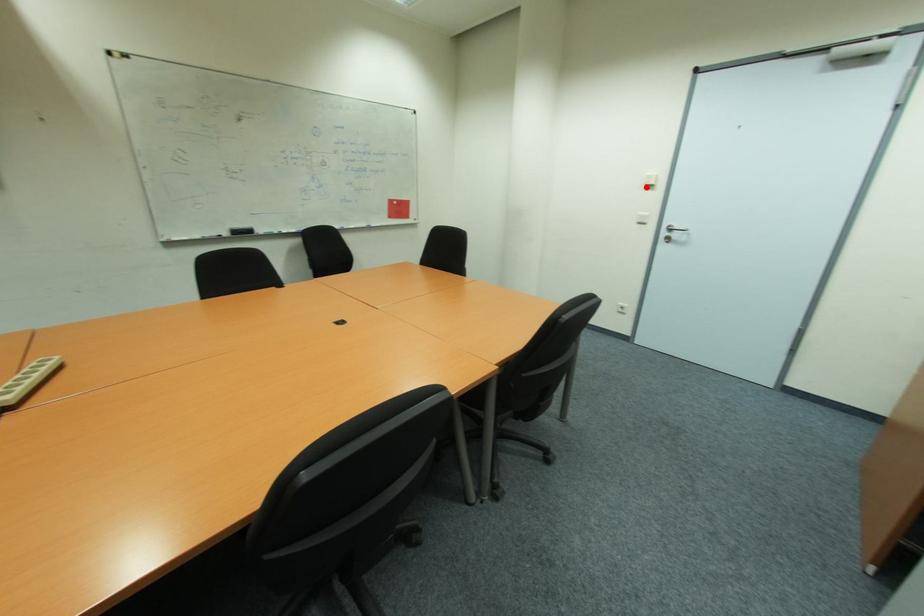
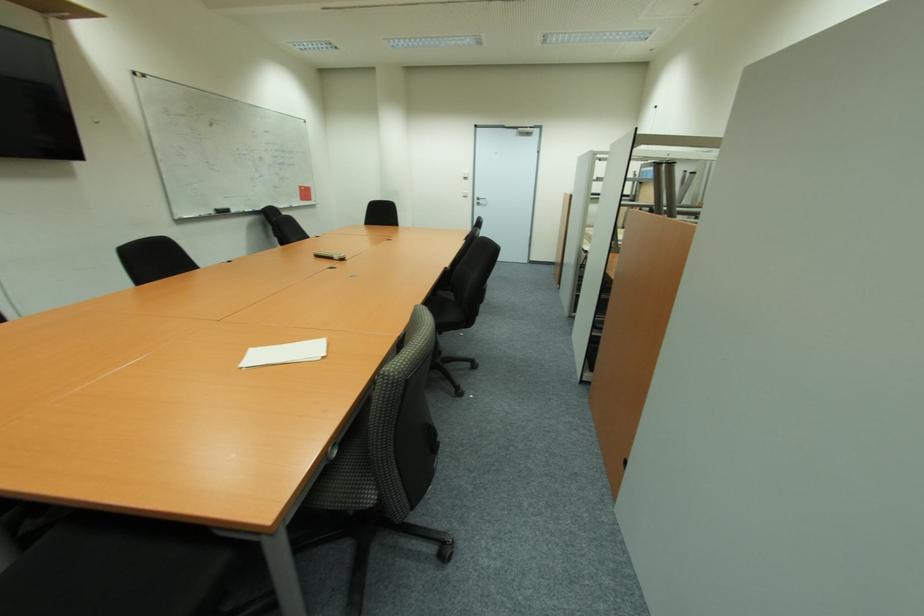
Where in the second image is the point corresponding to the highlighted location from the first image?

(467, 179)